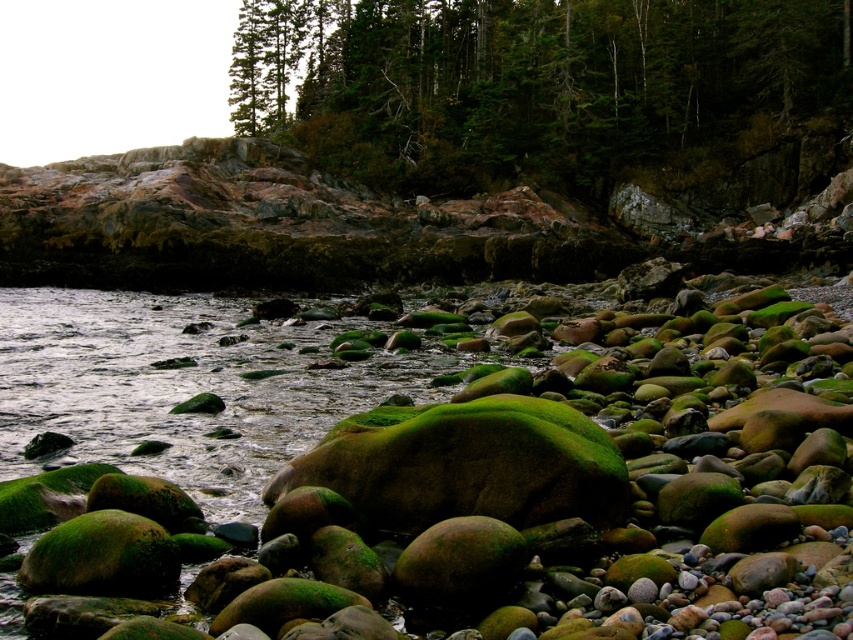
You are a drone operator trying to capture a photo of the green textured tree at upper center. The camera is currently positioned at point A, which is at coordinates 0.136, 0.639. Is the camera already aligned with the tree?

The 2D location of the green textured tree at upper center is at point (544, 86), so yes, the camera is already aligned with the tree since it is positioned at the same coordinates.

You are standing at the shoreline and want to take a photo of the green textured tree at upper center. If your camera has a maximum zoom range of 100 meters, will you be able to capture the tree clearly without moving closer?

The green textured tree at upper center is 85.74 meters away from the camera. Since the camera can zoom up to 100 meters, you can capture the tree clearly without moving closer.

You are standing at the edge of the rocky shoreline and see two points marked in the scene. The first point is at coordinates point (408, 186) and the second is at point (41, 317). Which point is closer to your current position?

Point (408, 186) is further to the camera than point (41, 317), so the point closer to your current position is point (41, 317).